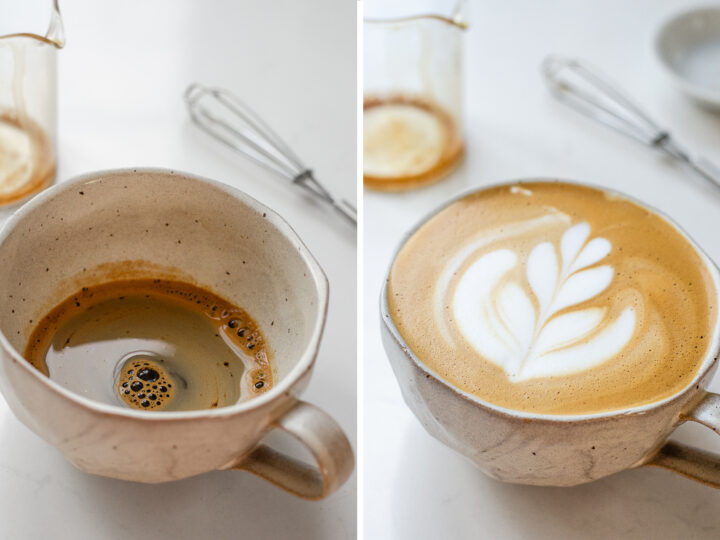
The width and height of the screenshot is (720, 540). In order to click on bowl in this screenshot , I will do `click(675, 58)`.